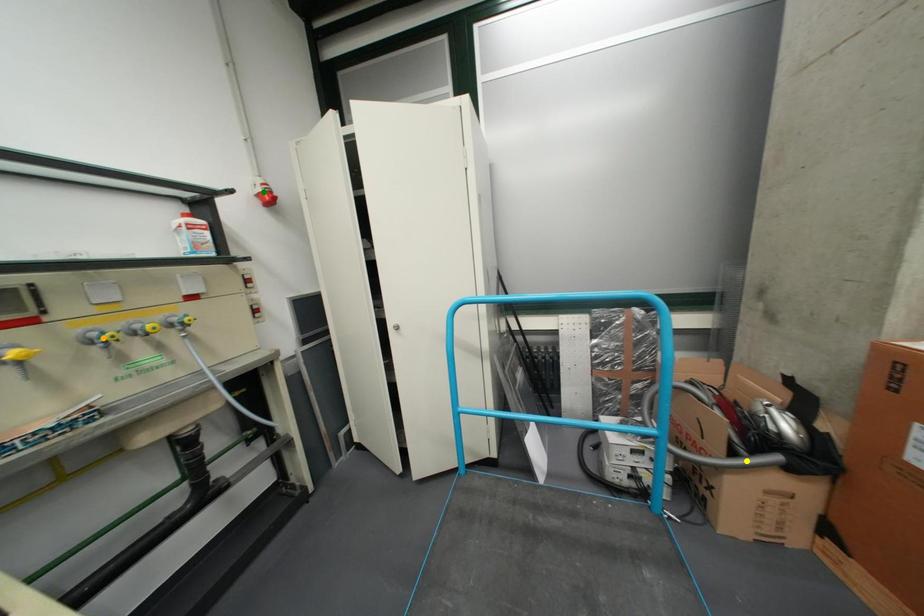
Order these from nearest to farthest:
orange point
yellow point
green point

orange point
yellow point
green point